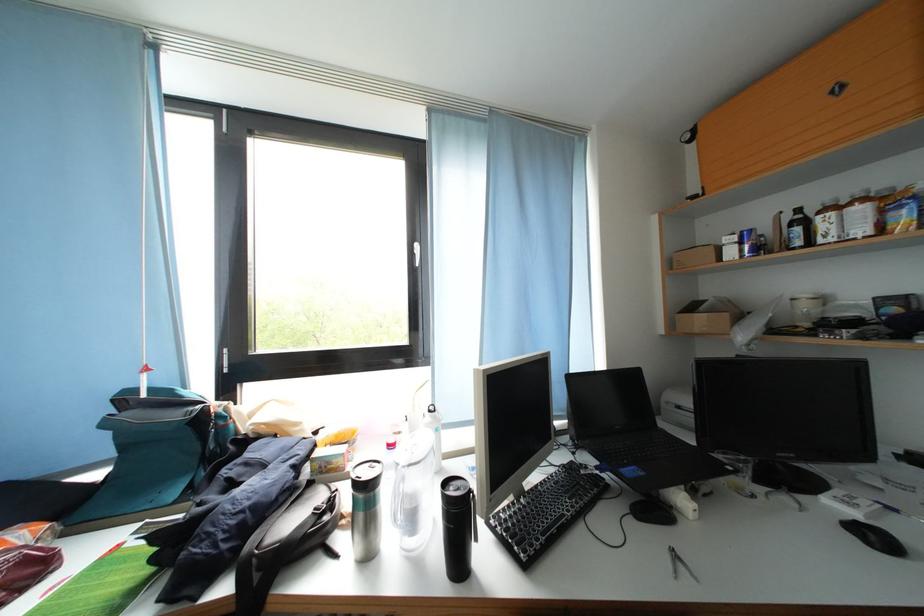
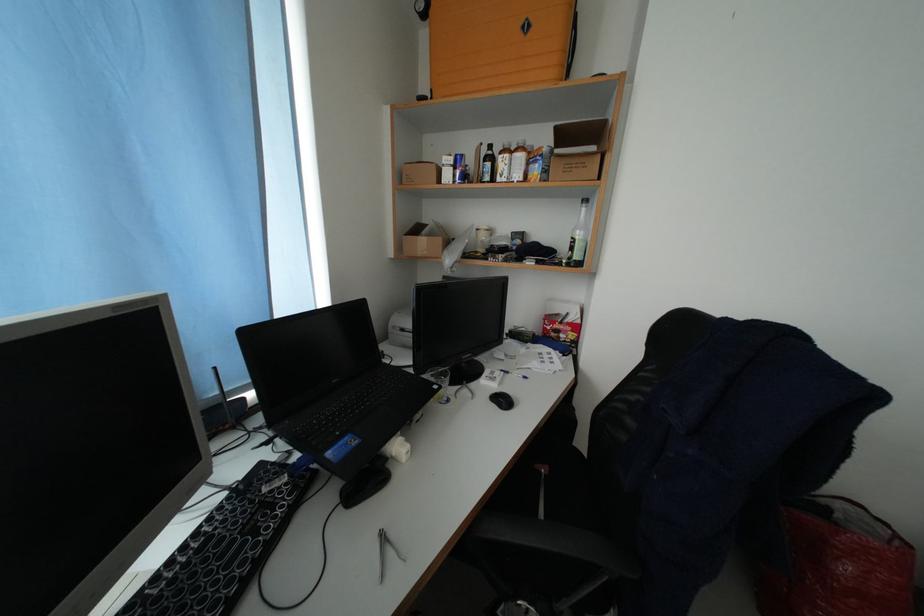
In the second image, find the point that corresponds to [793,504] in the first image.

(473, 397)